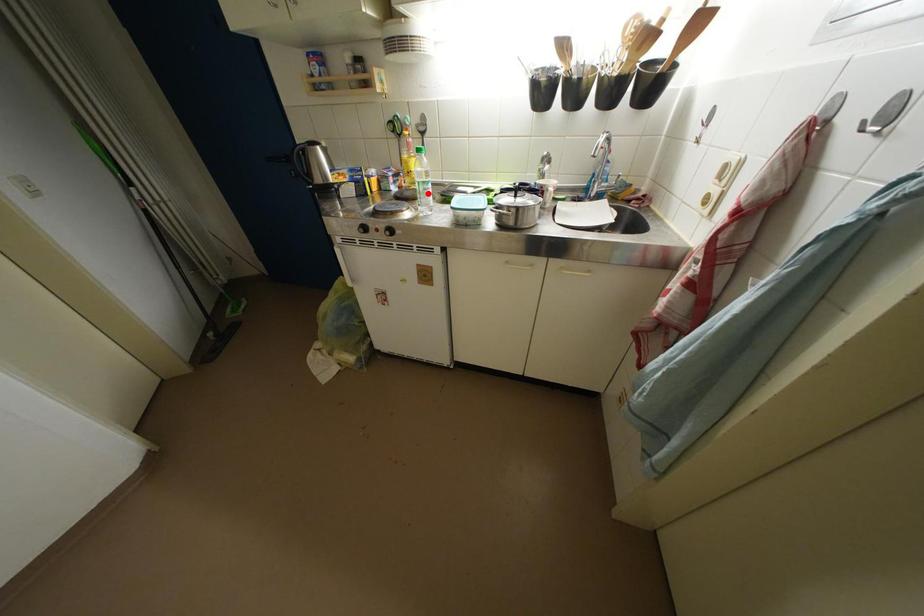
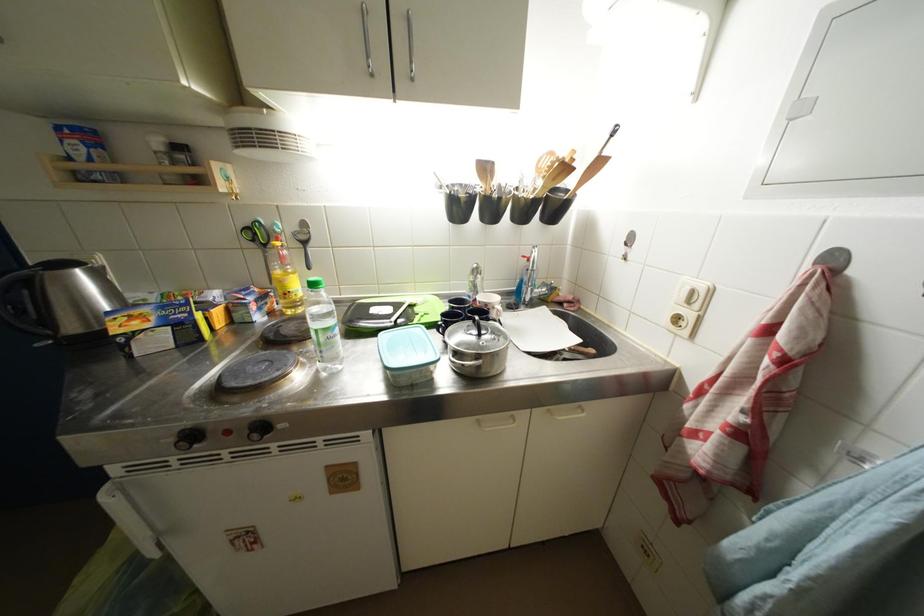
The point at the highlighted location is marked in the first image. Where is the corresponding point in the second image?

(329, 344)